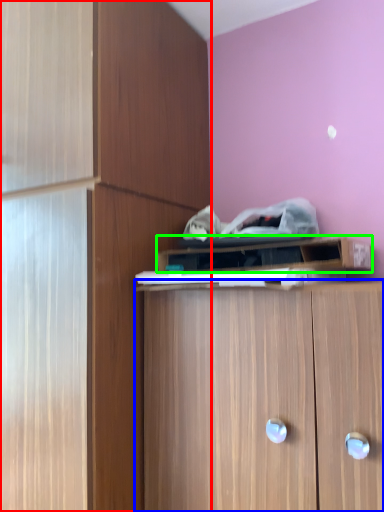
Question: Considering the real-world distances, which object is farthest from cabinetry (highlighted by a red box)? cabinetry (highlighted by a blue box) or cabinetry (highlighted by a green box)?

Choices:
 (A) cabinetry
 (B) cabinetry

Answer: (A)